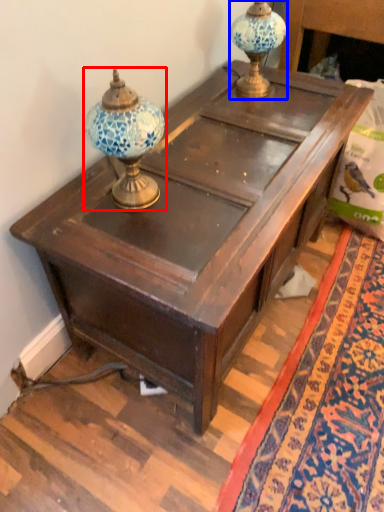
Question: Among these objects, which one is farthest to the camera, candle holder (highlighted by a red box) or candle holder (highlighted by a blue box)?

Choices:
 (A) candle holder
 (B) candle holder

Answer: (B)